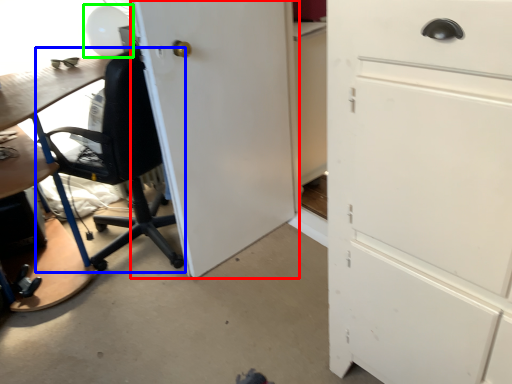
Question: Based on their relative distances, which object is farther from door (highlighted by a red box)? Choose from chair (highlighted by a blue box) and table lamp (highlighted by a green box).

Choices:
 (A) chair
 (B) table lamp

Answer: (B)